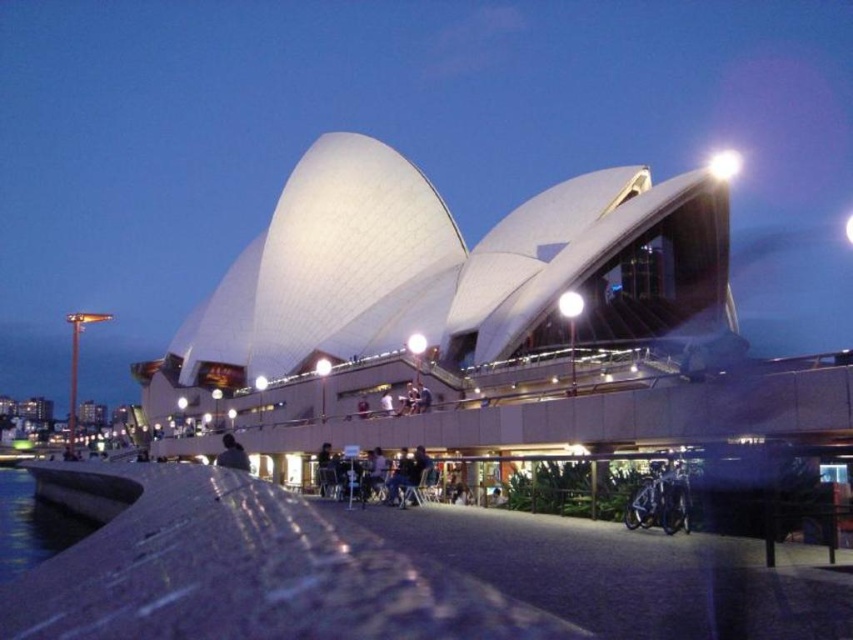
Who is more distant from viewer, (38, 513) or (239, 451)?

Positioned behind is point (38, 513).

How much distance is there between clear water at lower left and light brown wooden chair at lower center?

clear water at lower left is 33.80 meters from light brown wooden chair at lower center.

Between point (39, 520) and point (225, 454), which one is positioned in front?

Point (225, 454) is in front.

Where is `clear water at lower left`? The height and width of the screenshot is (640, 853). clear water at lower left is located at coordinates (32, 524).